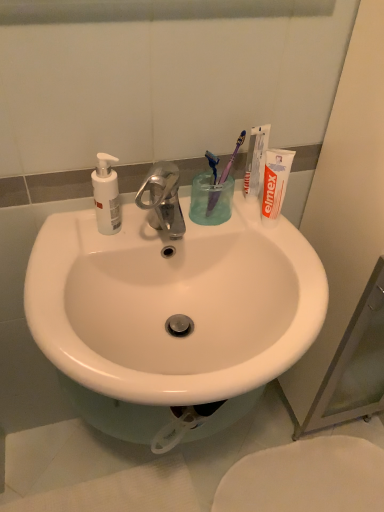
Identify the location of vacant space underneath white glossy toilet at lower right (from a real-world perspective). This screenshot has width=384, height=512. (310, 482).